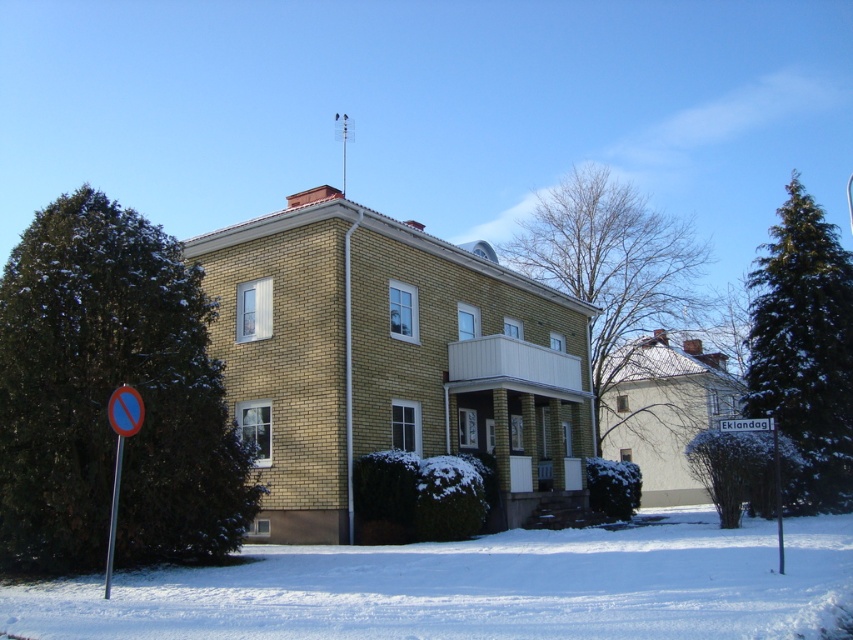
You are a delivery person trying to park your van in the driveway of this house. The driveway is located between the green leafy tree at left and the blue reflective plastic sign at lower left. Since the van is 2 meters wide, can you fit it there?

The green leafy tree at left is wider than the blue reflective plastic sign at lower left. However, the exact width of the space between them isn

You are a delivery person trying to reach the front door of the house. You see the white powdery snow at lower center and the metallic pole at center. Which path should you avoid stepping on to prevent sinking into the snow?

You should avoid stepping on the white powdery snow at lower center because it might be wider than the metallic pole at center, meaning the snow could be deeper or more compact, causing you to sink.

You are standing in front of the house and notice a point at coordinate [125,410]. Based on the scene description, can you determine where this point is located?

The point at coordinate [125,410] is located on the metallic circular sign at lower left.